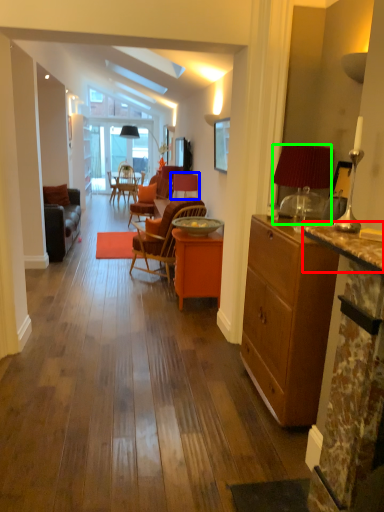
Question: Which is nearer to the counter top (highlighted by a red box)? chair (highlighted by a blue box) or lamp (highlighted by a green box).

Choices:
 (A) chair
 (B) lamp

Answer: (B)